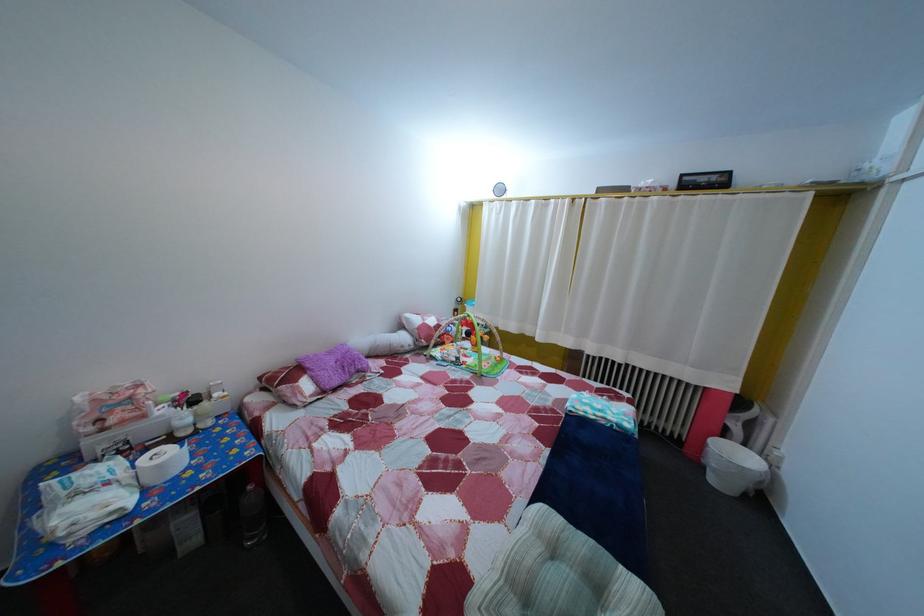
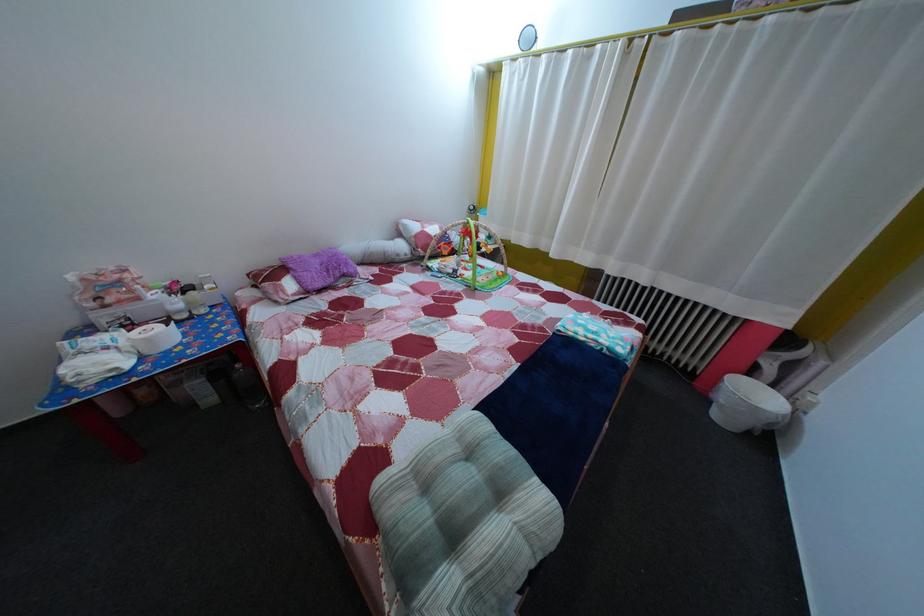
Question: How did the camera likely rotate?

Choices:
 (A) Left
 (B) Right
 (C) Up
 (D) Down

Answer: (D)